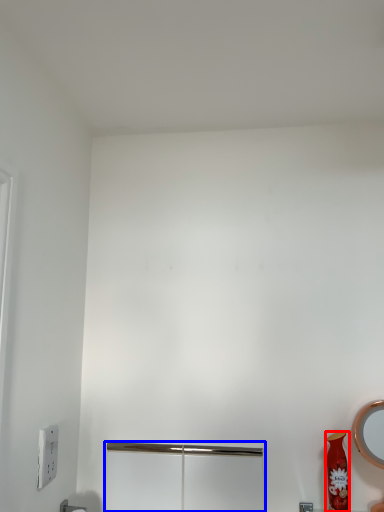
Question: Which of the following is the farthest to the observer, vase (highlighted by a red box) or screen door (highlighted by a blue box)?

Choices:
 (A) vase
 (B) screen door

Answer: (B)